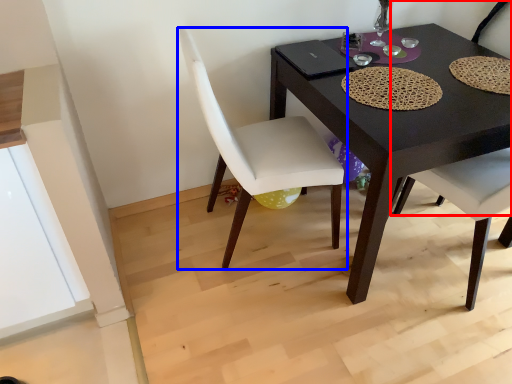
Question: Which object is closer to the camera taking this photo, chair (highlighted by a red box) or chair (highlighted by a blue box)?

Choices:
 (A) chair
 (B) chair

Answer: (B)